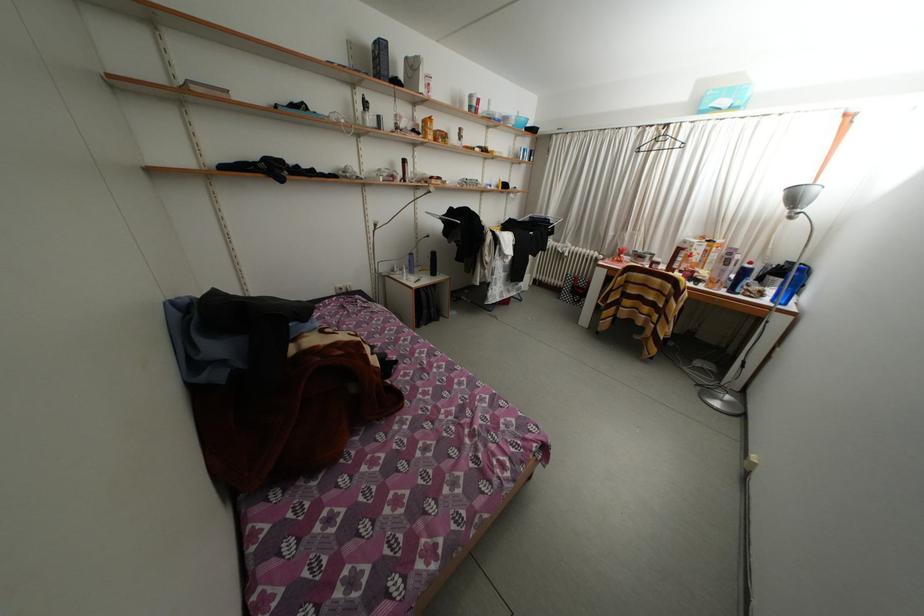
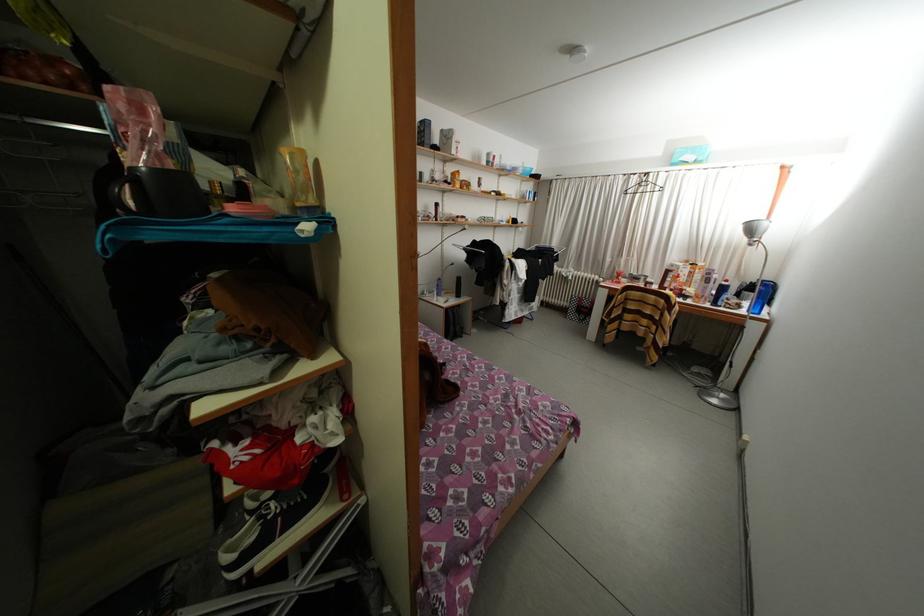
The point at (769, 299) is marked in the first image. Where is the corresponding point in the second image?

(747, 310)